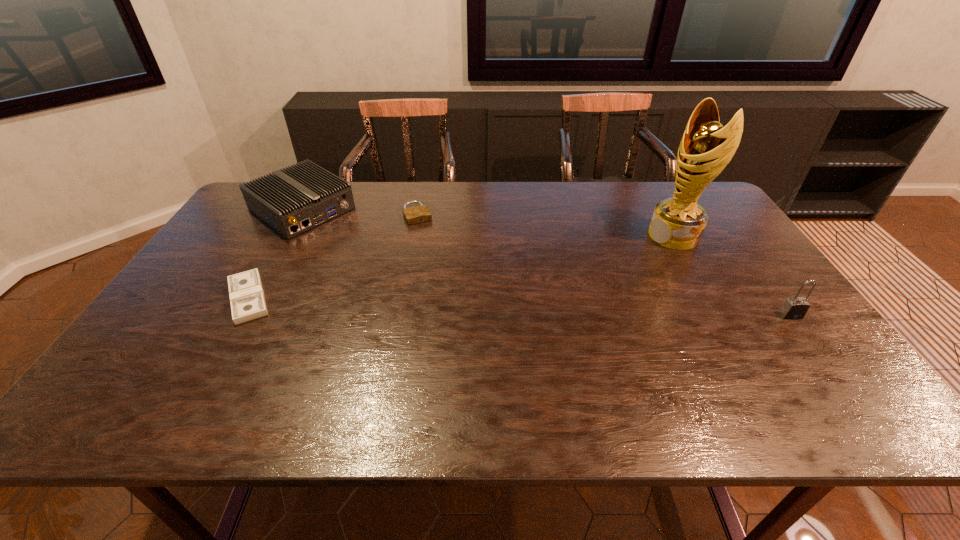
This screenshot has width=960, height=540. Identify the location of padlock located at the far edge. (417, 214).

The height and width of the screenshot is (540, 960). Find the location of `dollar positioned at the left edge`. dollar positioned at the left edge is located at coordinates (247, 300).

What are the coordinates of `router at the left edge` in the screenshot? It's located at (294, 200).

What are the coordinates of `padlock at the right edge` in the screenshot? It's located at (796, 307).

Find the location of a particular element. The height and width of the screenshot is (540, 960). award located in the right edge section of the desktop is located at coordinates (706, 147).

You are a GUI agent. You are given a task and a screenshot of the screen. Output one action in this format:
    pyautogui.click(x=<x>, y=<y>)
    Task: Click on the object that is at the far left corner
    
    Given the screenshot: What is the action you would take?
    pyautogui.click(x=294, y=200)

At what (x,y) coordinates should I click in order to perform the action: click on vacant area at the far edge. Please return your answer as a coordinate pair (x, y). Image resolution: width=960 pixels, height=540 pixels. Looking at the image, I should click on (398, 208).

I want to click on vacant area at the near edge, so click(x=429, y=370).

Find the location of a particular element. Image resolution: width=960 pixels, height=540 pixels. vacant space at the left edge of the desktop is located at coordinates coord(203,268).

I want to click on free space at the right edge, so click(x=732, y=257).